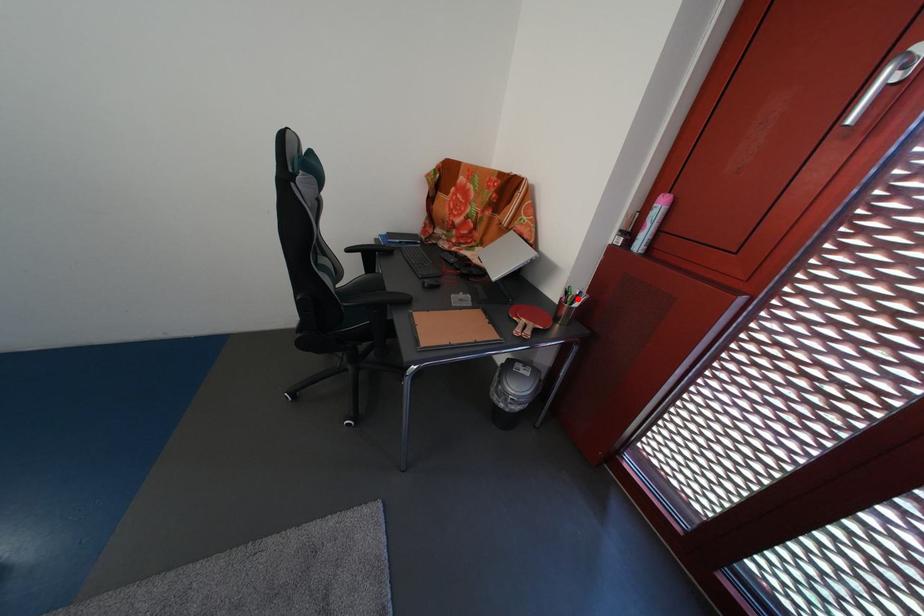
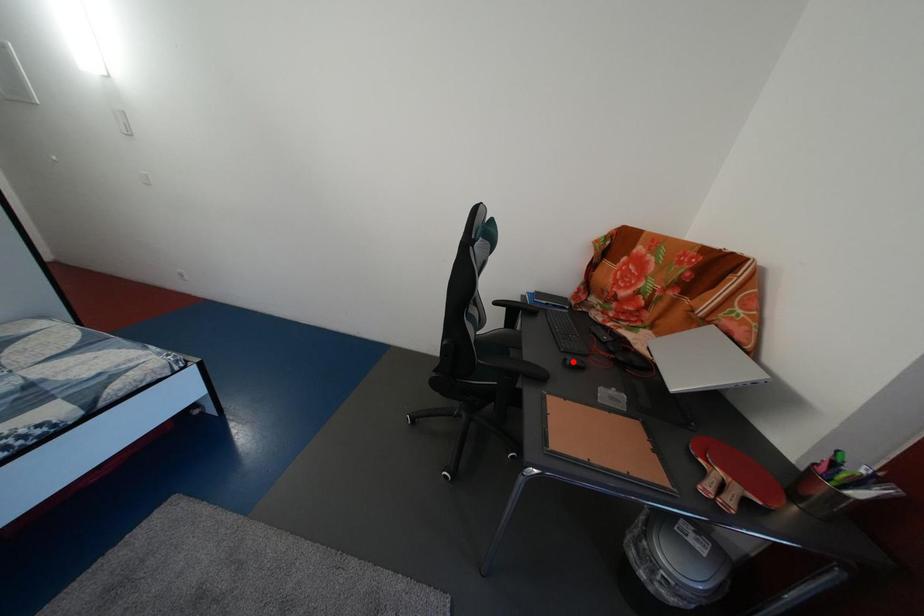
From the picture: I am providing you with two images of the same scene from different viewpoints. A red point is marked on the first image and another point is marked on the second image. Are the points marked in image1 and image2 representing the same 3D position?

No